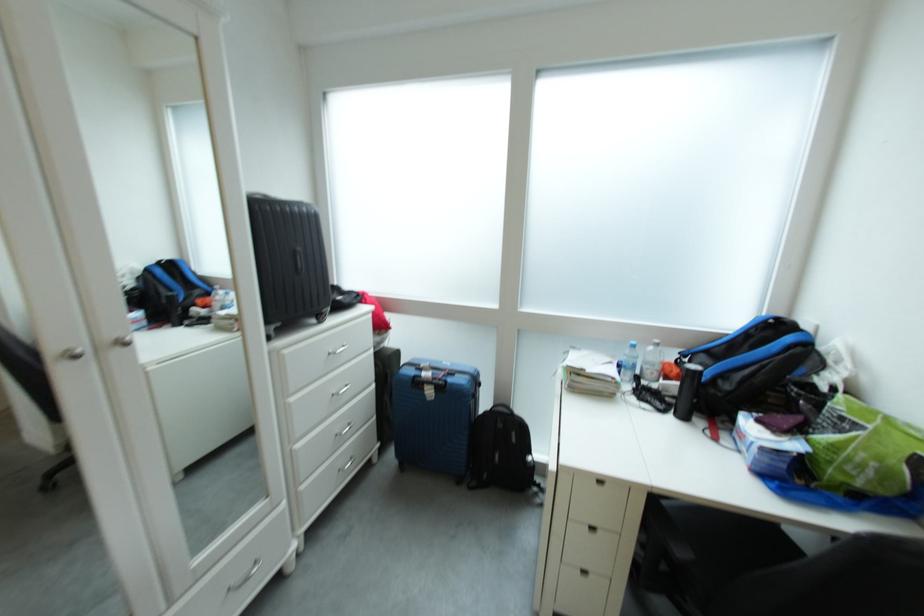
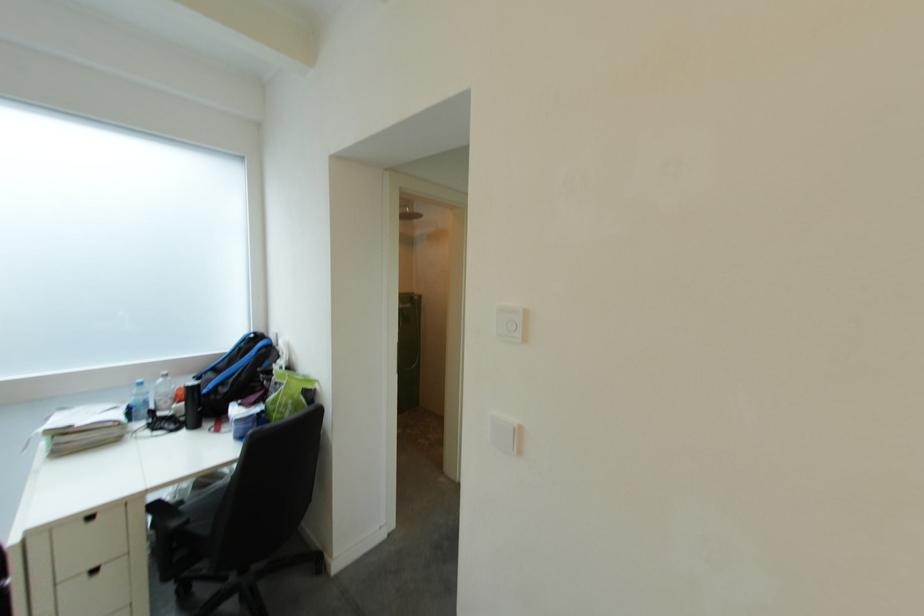
The point at (631,369) is marked in the first image. Where is the corresponding point in the second image?

(141, 411)